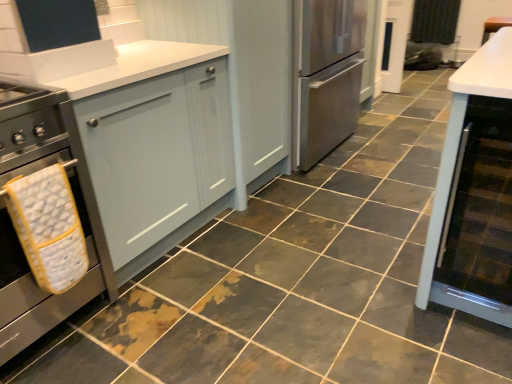
Question: Considering the positions of matte gray cabinet at center, placed as the 2th cabinetry when sorted from left to right, and matte glass cabinet at right, which is the third cabinetry in left-to-right order, in the image, is matte gray cabinet at center, placed as the 2th cabinetry when sorted from left to right, taller or shorter than matte glass cabinet at right, which is the third cabinetry in left-to-right order,?

Choices:
 (A) tall
 (B) short

Answer: (A)

Question: Considering the positions of point (240, 185) and point (419, 299), is point (240, 185) closer or farther from the camera than point (419, 299)?

Choices:
 (A) farther
 (B) closer

Answer: (A)

Question: Estimate the real-world distances between objects in this image. Which object is farther from the yellow fabric oven mitt at left?

Choices:
 (A) matte gray cabinet at left, the third cabinetry when ordered from right to left
 (B) matte glass cabinet at right, which is the third cabinetry in left-to-right order
 (C) black fabric curtain at upper right
 (D) matte gray cabinet at center, positioned as the second cabinetry in right-to-left order
 (E) stainless steel oven at left

Answer: (C)

Question: Based on their relative distances, which object is nearer to the matte gray cabinet at left, which is the 1th cabinetry in left-to-right order?

Choices:
 (A) black fabric curtain at upper right
 (B) yellow fabric oven mitt at left
 (C) matte gray cabinet at center, positioned as the second cabinetry in right-to-left order
 (D) matte glass cabinet at right, which is the third cabinetry in left-to-right order
 (E) stainless steel oven at left

Answer: (E)